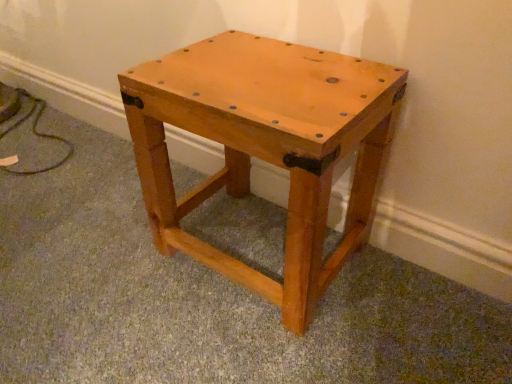
Where is `vacant space in light brown wood stool at center (from a real-world perspective)`? vacant space in light brown wood stool at center (from a real-world perspective) is located at coordinates (249, 228).